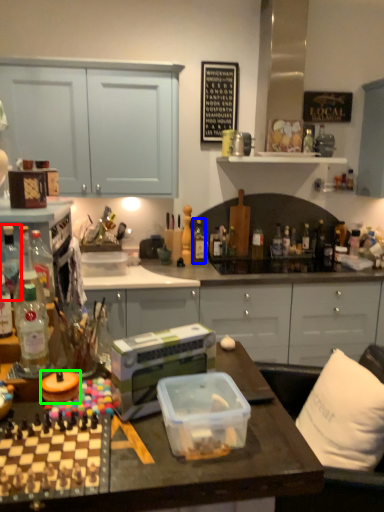
Question: Based on their relative distances, which object is farther from bottle (highlighted by a red box)? Choose from bottle (highlighted by a blue box) and appliance (highlighted by a green box).

Choices:
 (A) bottle
 (B) appliance

Answer: (A)